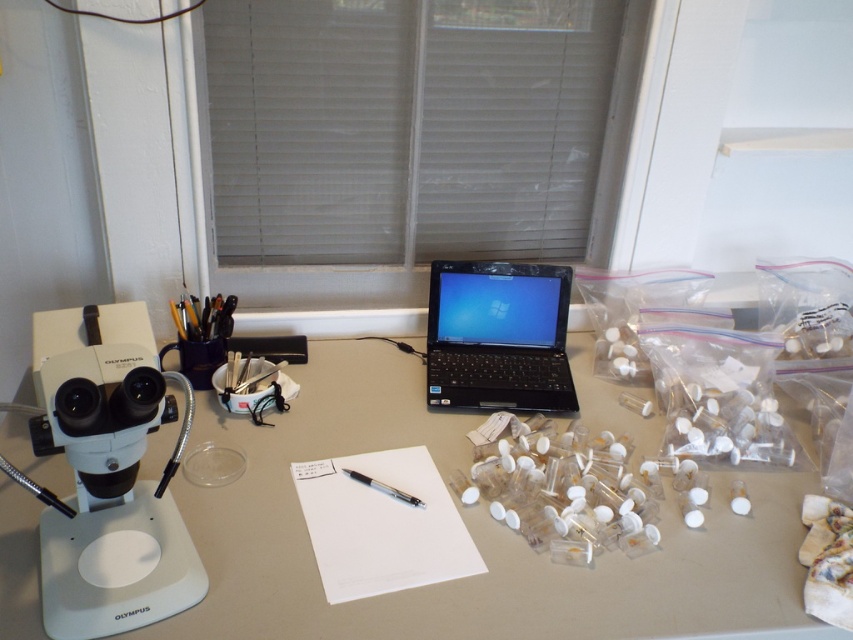
Question: Which of the following is the closest to the observer?

Choices:
 (A) (357, 477)
 (B) (476, 532)
 (C) (350, 131)
 (D) (531, 410)

Answer: (B)

Question: Among these points, which one is nearest to the camera?

Choices:
 (A) (306, 468)
 (B) (402, 234)
 (C) (779, 486)

Answer: (A)

Question: Which point is closer to the camera?

Choices:
 (A) white matte blinds at upper center
 (B) white plastic microscope at left

Answer: (B)

Question: Can you confirm if white matte blinds at upper center is positioned to the right of black metallic pen at center?

Choices:
 (A) no
 (B) yes

Answer: (B)

Question: Does white plastic microscope at left have a larger size compared to black metallic pen at center?

Choices:
 (A) no
 (B) yes

Answer: (B)

Question: Is white matte blinds at upper center positioned before black plastic laptop at center?

Choices:
 (A) no
 (B) yes

Answer: (B)